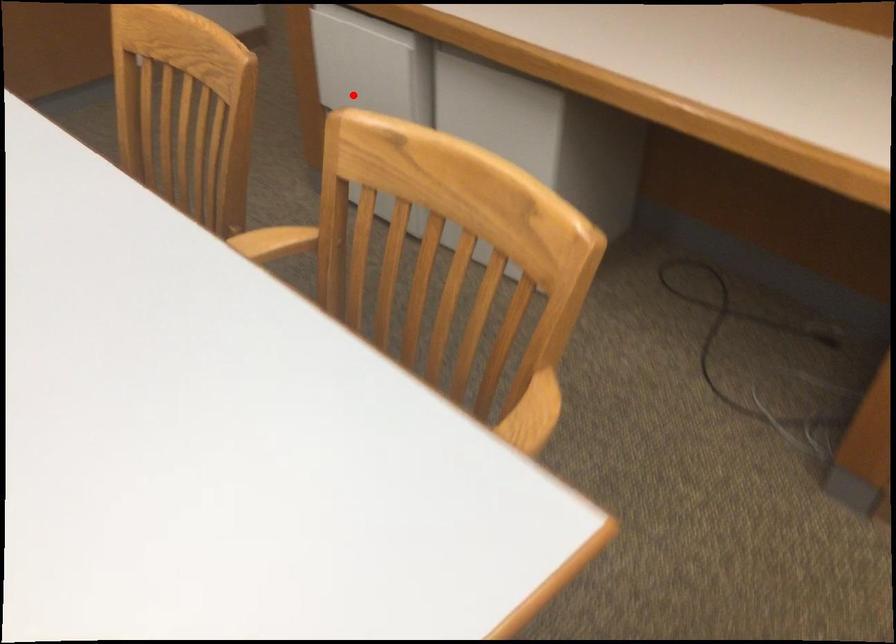
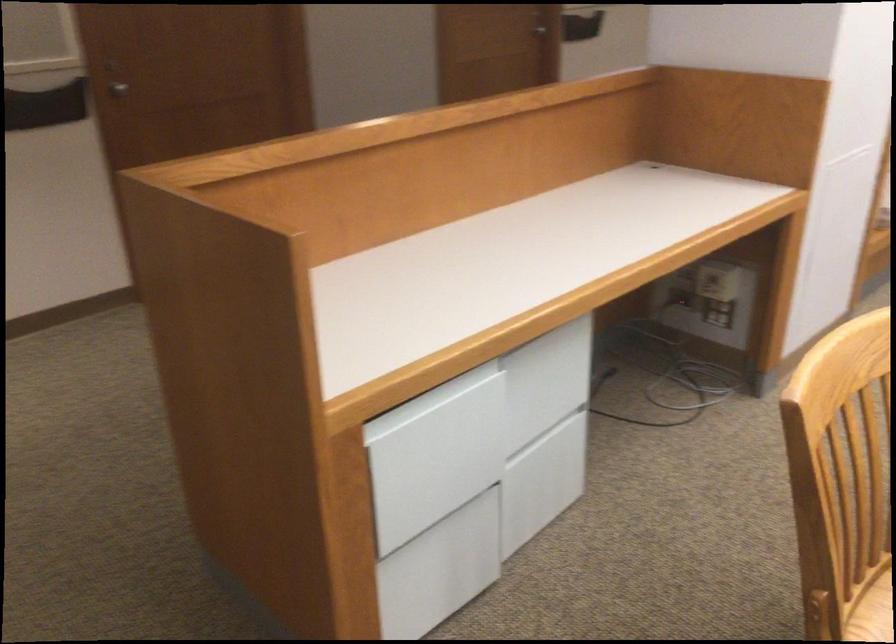
Question: I am providing you with two images of the same scene from different viewpoints. Given a red point in image1, look at the same physical point in image2. Is it:

Choices:
 (A) Closer to the viewpoint
 (B) Farther from the viewpoint

Answer: (A)